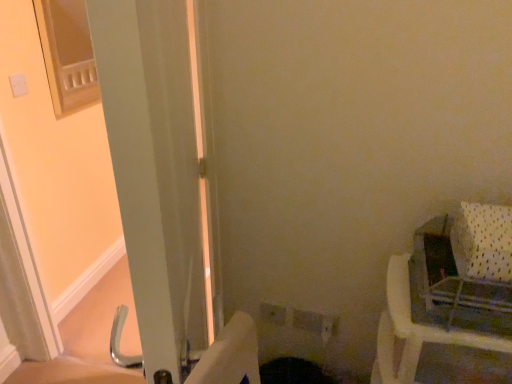
Question: Considering the relative sizes of white plastic chair at right and white glossy screen door at left in the image provided, is white plastic chair at right shorter than white glossy screen door at left?

Choices:
 (A) no
 (B) yes

Answer: (B)

Question: Is white plastic chair at right not close to white glossy screen door at left?

Choices:
 (A) yes
 (B) no

Answer: (B)

Question: Is white plastic chair at right at the left side of white glossy screen door at left?

Choices:
 (A) no
 (B) yes

Answer: (A)

Question: Is white plastic chair at right further to the viewer compared to white glossy screen door at left?

Choices:
 (A) no
 (B) yes

Answer: (B)

Question: From the image's perspective, would you say white plastic chair at right is positioned over white glossy screen door at left?

Choices:
 (A) no
 (B) yes

Answer: (A)

Question: Can you confirm if white plastic chair at right is thinner than white glossy screen door at left?

Choices:
 (A) yes
 (B) no

Answer: (B)

Question: From the image's perspective, is white glossy screen door at left above white plastic chair at right?

Choices:
 (A) no
 (B) yes

Answer: (B)

Question: Does white glossy screen door at left have a lesser height compared to white plastic chair at right?

Choices:
 (A) yes
 (B) no

Answer: (B)

Question: Is white glossy screen door at left further to camera compared to white plastic chair at right?

Choices:
 (A) no
 (B) yes

Answer: (A)

Question: Does white glossy screen door at left lie in front of white plastic chair at right?

Choices:
 (A) yes
 (B) no

Answer: (A)

Question: From a real-world perspective, is white glossy screen door at left under white plastic chair at right?

Choices:
 (A) yes
 (B) no

Answer: (B)

Question: Can you confirm if white glossy screen door at left is smaller than white plastic chair at right?

Choices:
 (A) yes
 (B) no

Answer: (B)

Question: Is white plastic baby carriage at right outside of white glossy screen door at left?

Choices:
 (A) yes
 (B) no

Answer: (A)